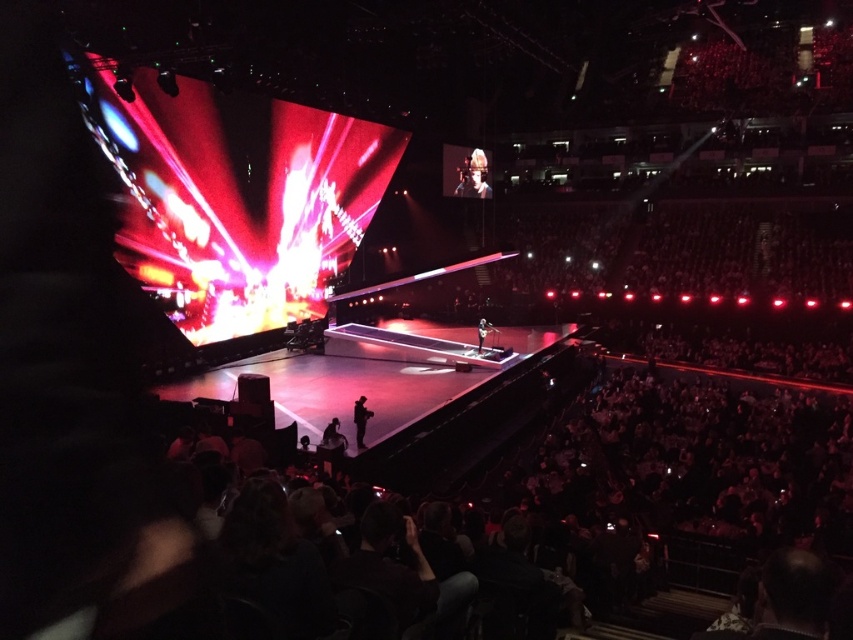
Question: Is smooth skin face at upper center above smooth black suit at center?

Choices:
 (A) yes
 (B) no

Answer: (A)

Question: Which point is farther from the camera taking this photo?

Choices:
 (A) (482, 156)
 (B) (361, 449)

Answer: (A)

Question: Which point appears closest to the camera in this image?

Choices:
 (A) (480, 339)
 (B) (489, 196)

Answer: (A)

Question: In this image, where is dark gray fabric jacket at center located relative to smooth black suit at center?

Choices:
 (A) below
 (B) above

Answer: (A)

Question: Among these points, which one is farthest from the camera?

Choices:
 (A) (479, 348)
 (B) (357, 429)
 (C) (482, 170)

Answer: (C)

Question: Is smooth skin face at upper center smaller than dark gray fabric jacket at center?

Choices:
 (A) yes
 (B) no

Answer: (B)